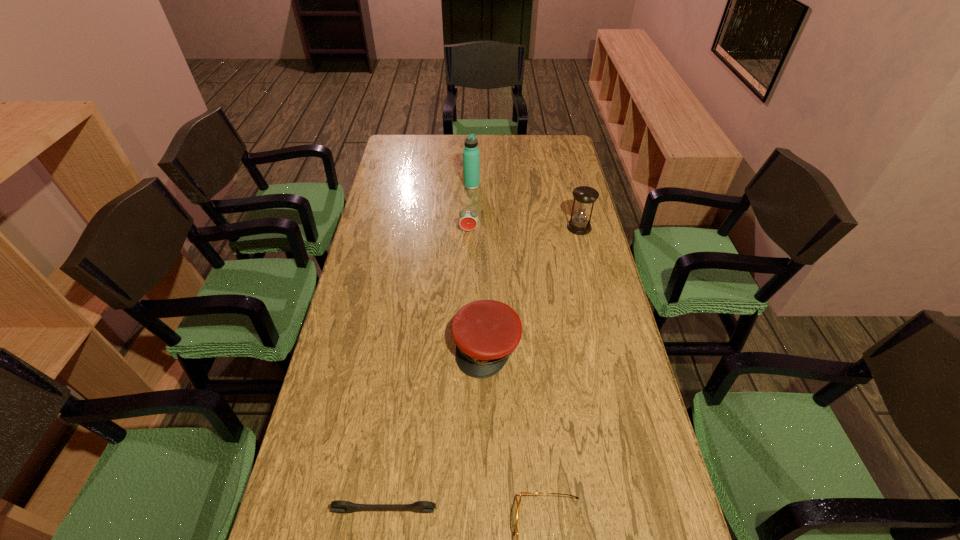
This screenshot has width=960, height=540. Identify the location of the tallest object. (471, 152).

What are the coordinates of `thermos bottle` in the screenshot? It's located at (471, 152).

This screenshot has width=960, height=540. In order to click on the rightmost object in this screenshot , I will do `click(585, 196)`.

You are a GUI agent. You are given a task and a screenshot of the screen. Output one action in this format:
    pyautogui.click(x=<x>, y=<y>)
    Task: Click on the fifth shortest object
    The image size is (960, 540).
    Given the screenshot: What is the action you would take?
    pyautogui.click(x=585, y=196)

Locate an element on the screen. This screenshot has height=540, width=960. alarm clock is located at coordinates (468, 220).

This screenshot has height=540, width=960. I want to click on the fourth farthest object, so click(486, 332).

Find the location of a particular element. The height and width of the screenshot is (540, 960). the leftmost object is located at coordinates (344, 507).

Where is `blank space located on the right of the thermos bottle`? blank space located on the right of the thermos bottle is located at coordinates (535, 185).

Find the location of `vacant space situated 0.370m on the front of the rightmost object`. vacant space situated 0.370m on the front of the rightmost object is located at coordinates (600, 313).

This screenshot has height=540, width=960. What are the coordinates of `vacant space located on the face of the alarm clock` in the screenshot? It's located at (468, 264).